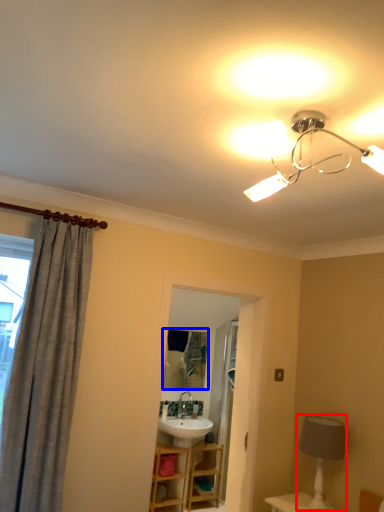
Question: Among these objects, which one is nearest to the camera, table lamp (highlighted by a red box) or mirror (highlighted by a blue box)?

Choices:
 (A) table lamp
 (B) mirror

Answer: (A)